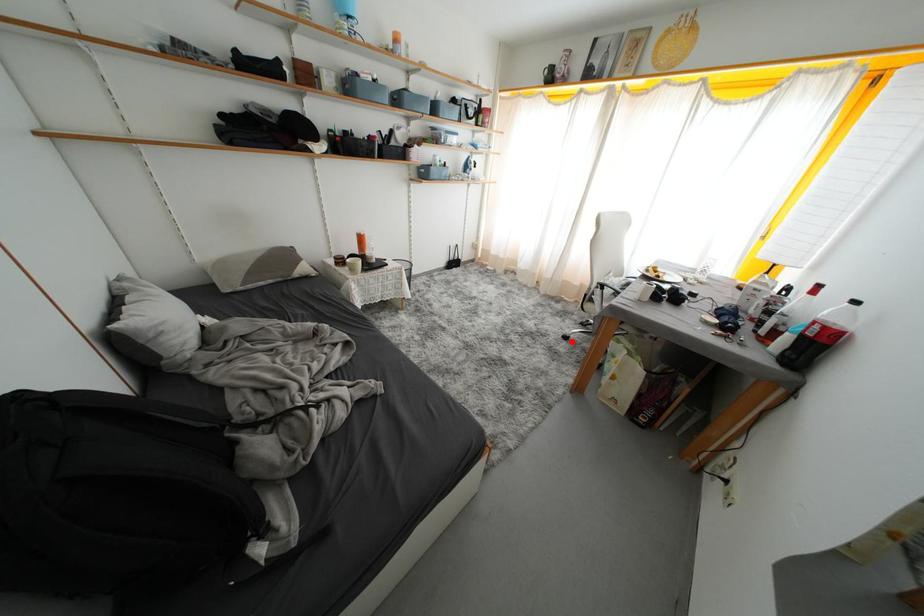
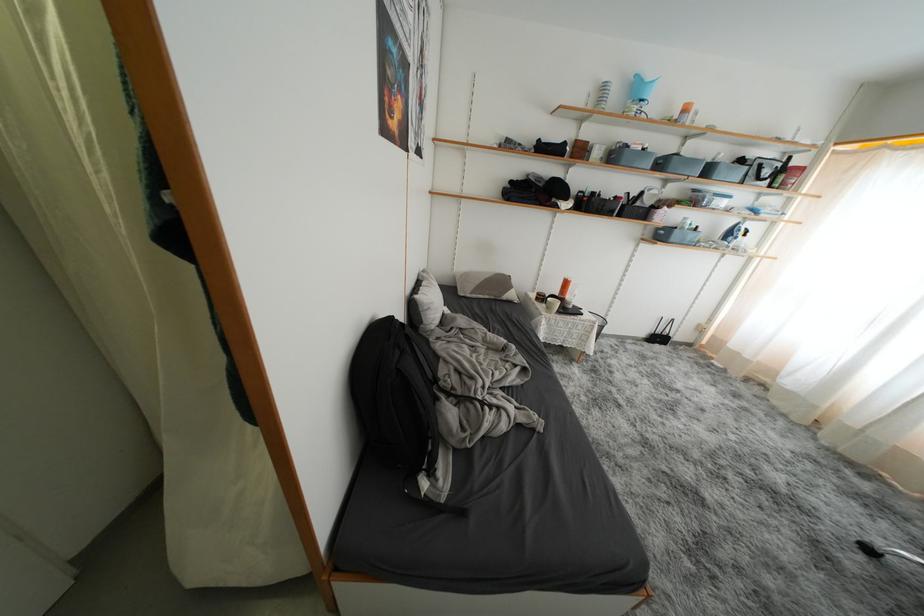
The point at the highlighted location is marked in the first image. Where is the corresponding point in the second image?

(876, 554)